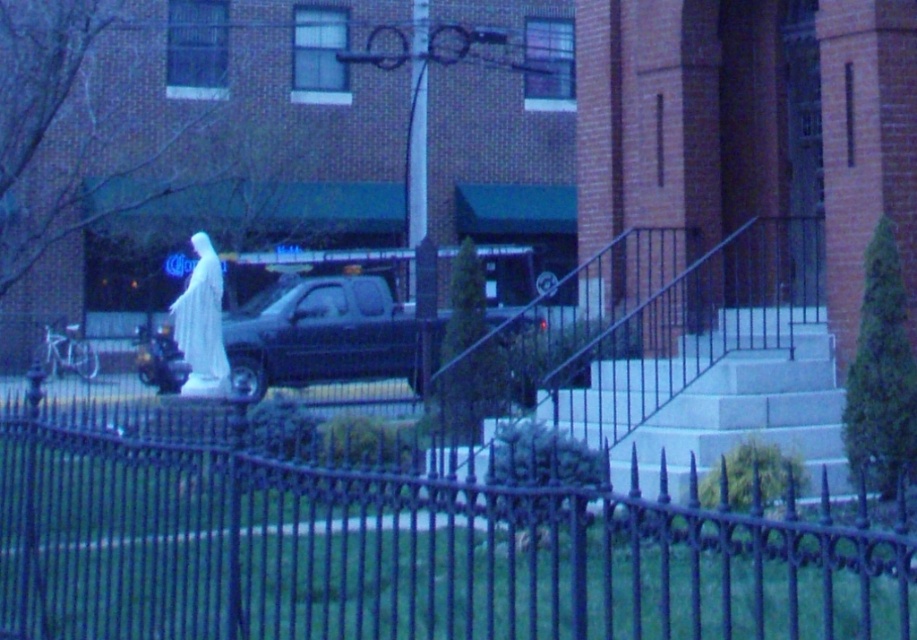
Question: Estimate the real-world distances between objects in this image. Which object is farther from the matte black truck at center?

Choices:
 (A) black wrought iron fence at center
 (B) white marble statue at center

Answer: (B)

Question: Can you confirm if black wrought iron fence at center is positioned to the left of matte black truck at center?

Choices:
 (A) no
 (B) yes

Answer: (A)

Question: Is the position of black wrought iron fence at center more distant than that of white marble statue at center?

Choices:
 (A) no
 (B) yes

Answer: (A)

Question: Which point appears closest to the camera in this image?

Choices:
 (A) (289, 365)
 (B) (203, 356)

Answer: (B)

Question: Which point is farther from the camera taking this photo?

Choices:
 (A) (567, 588)
 (B) (402, 362)

Answer: (B)

Question: Can you confirm if black wrought iron fence at center is positioned above white marble statue at center?

Choices:
 (A) no
 (B) yes

Answer: (A)